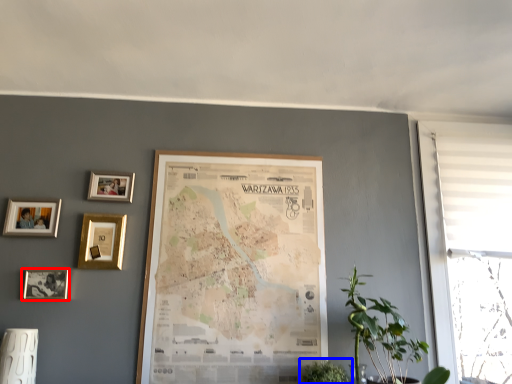
Question: Which object appears closest to the camera in this image, picture frame (highlighted by a red box) or houseplant (highlighted by a blue box)?

Choices:
 (A) picture frame
 (B) houseplant

Answer: (B)